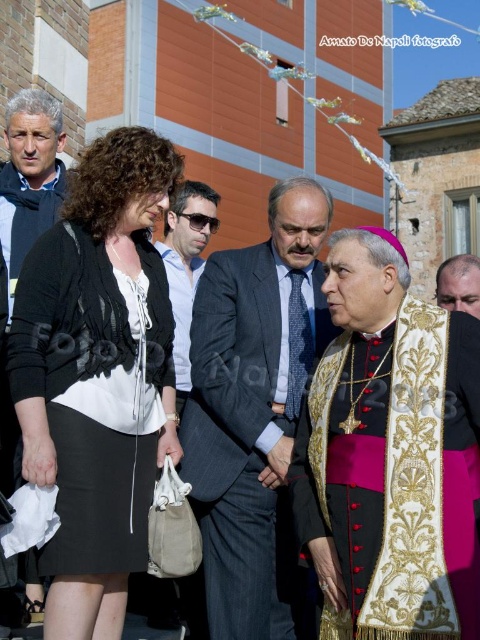
Question: Is dark gray suit at center thinner than light brown leather jacket at center?

Choices:
 (A) no
 (B) yes

Answer: (A)

Question: Considering the relative positions of light brown leather jacket at center and gold embroidered stole at right in the image provided, where is light brown leather jacket at center located with respect to gold embroidered stole at right?

Choices:
 (A) below
 (B) above

Answer: (A)

Question: Which of these objects is positioned closest to the gold embroidered vestment at right?

Choices:
 (A) gold embroidered stole at right
 (B) dark gray suit at center

Answer: (B)

Question: Which object appears farthest from the camera in this image?

Choices:
 (A) matte black sweater at left
 (B) dark gray suit at center

Answer: (B)

Question: Can you confirm if gold embroidered vestment at right is positioned to the right of light brown leather jacket at center?

Choices:
 (A) yes
 (B) no

Answer: (A)

Question: Which of the following is the farthest from the observer?

Choices:
 (A) (189, 228)
 (B) (35, 144)

Answer: (A)